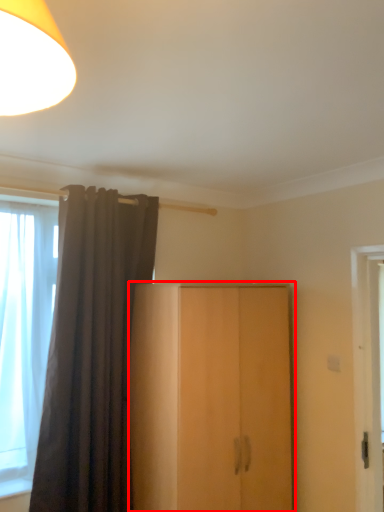
Question: From the image's perspective, what is the correct spatial relationship of cupboard (annotated by the red box) in relation to curtain?

Choices:
 (A) above
 (B) below

Answer: (B)